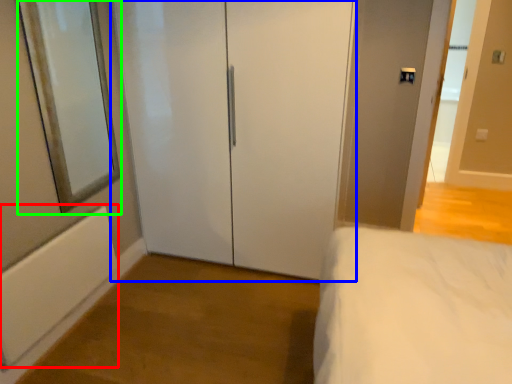
Question: Considering the real-world distances, which object is closest to radiator (highlighted by a red box)? door (highlighted by a blue box) or mirror (highlighted by a green box).

Choices:
 (A) door
 (B) mirror

Answer: (B)